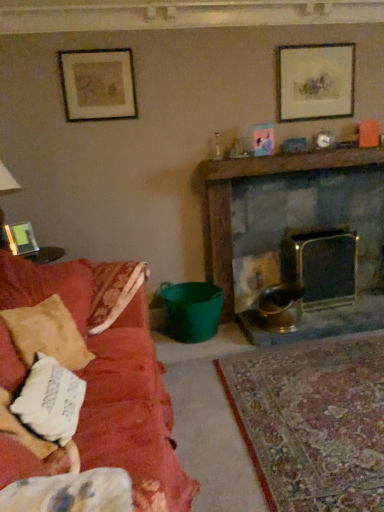
Question: Does white cotton pillow at left have a smaller size compared to dark gray stone fireplace at center right?

Choices:
 (A) no
 (B) yes

Answer: (B)

Question: Considering the relative sizes of white cotton pillow at left and dark gray stone fireplace at center right in the image provided, is white cotton pillow at left taller than dark gray stone fireplace at center right?

Choices:
 (A) no
 (B) yes

Answer: (A)

Question: From a real-world perspective, is white cotton pillow at left beneath dark gray stone fireplace at center right?

Choices:
 (A) no
 (B) yes

Answer: (B)

Question: From the image's perspective, would you say white cotton pillow at left is shown under dark gray stone fireplace at center right?

Choices:
 (A) yes
 (B) no

Answer: (A)

Question: Does white cotton pillow at left have a lesser width compared to dark gray stone fireplace at center right?

Choices:
 (A) no
 (B) yes

Answer: (B)

Question: Can you confirm if white cotton pillow at left is positioned to the left of dark gray stone fireplace at center right?

Choices:
 (A) no
 (B) yes

Answer: (B)

Question: From the image's perspective, is wooden mantel at upper center under matte black picture frame at upper right, which is counted as the 3th picture frame, starting from the bottom?

Choices:
 (A) yes
 (B) no

Answer: (A)

Question: From a real-world perspective, is wooden mantel at upper center located higher than matte black picture frame at upper right, which appears as the 1th picture frame when viewed from the right?

Choices:
 (A) yes
 (B) no

Answer: (B)

Question: Can you confirm if wooden mantel at upper center is wider than matte black picture frame at upper right, which is the 3th picture frame from left to right?

Choices:
 (A) no
 (B) yes

Answer: (B)

Question: Considering the relative sizes of wooden mantel at upper center and matte black picture frame at upper right, which appears as the 1th picture frame when viewed from the right, in the image provided, is wooden mantel at upper center thinner than matte black picture frame at upper right, which appears as the 1th picture frame when viewed from the right,?

Choices:
 (A) no
 (B) yes

Answer: (A)

Question: Does wooden mantel at upper center have a larger size compared to matte black picture frame at upper right, which is counted as the 3th picture frame, starting from the bottom?

Choices:
 (A) no
 (B) yes

Answer: (B)

Question: Is wooden mantel at upper center far away from matte black picture frame at upper right, which is counted as the 3th picture frame, starting from the bottom?

Choices:
 (A) yes
 (B) no

Answer: (B)

Question: Could you tell me if wooden mantel at upper center is turned towards dark gray stone fireplace at center right?

Choices:
 (A) no
 (B) yes

Answer: (A)